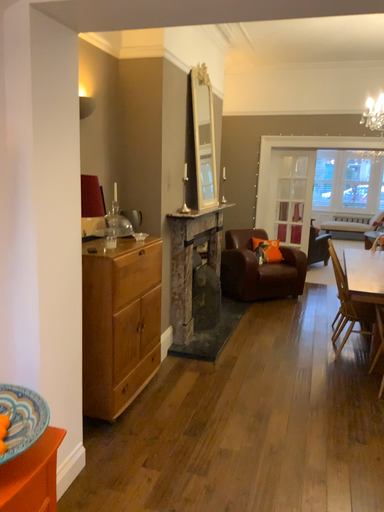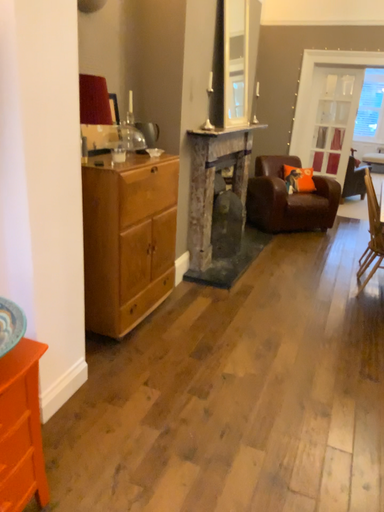
Question: How did the camera likely rotate when shooting the video?

Choices:
 (A) rotated downward
 (B) rotated upward

Answer: (A)